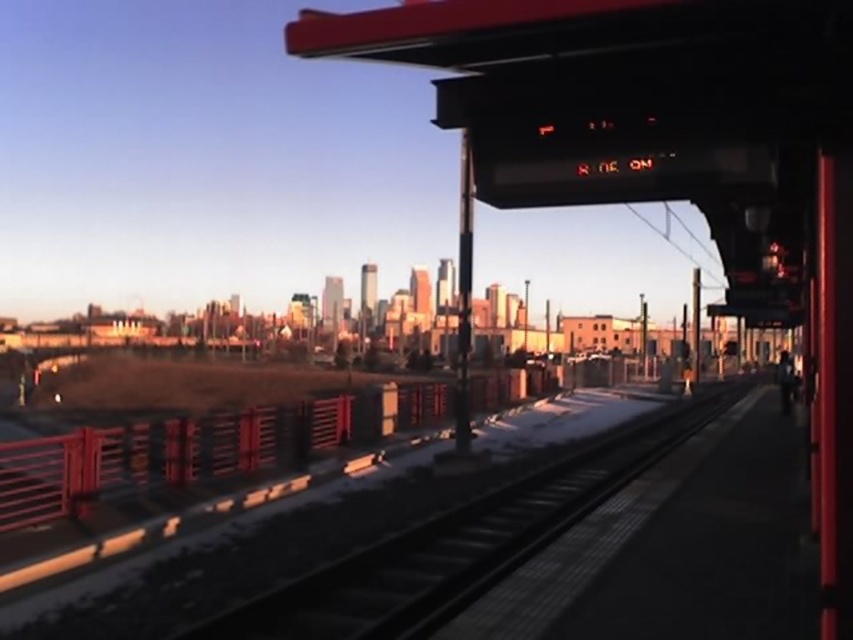
Can you confirm if metallic gray train track at center is smaller than metallic red rail at lower left?

Correct, metallic gray train track at center occupies less space than metallic red rail at lower left.

Which is above, metallic gray train track at center or metallic red rail at lower left?

metallic gray train track at center is above.

Between point (358, 602) and point (22, 449), which one is positioned behind?

Point (22, 449)

Find the location of a particular element. The width and height of the screenshot is (853, 640). metallic gray train track at center is located at coordinates (459, 545).